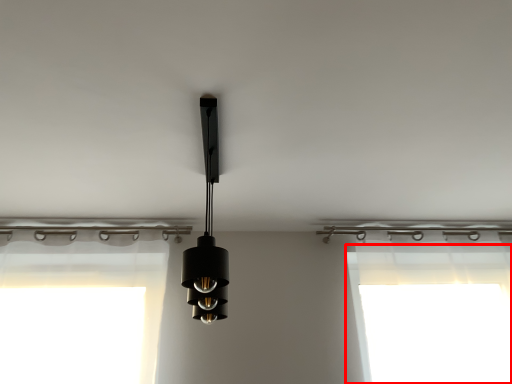
Question: Observing the image, what is the correct spatial positioning of window screen (annotated by the red box) in reference to lamp?

Choices:
 (A) left
 (B) right

Answer: (B)